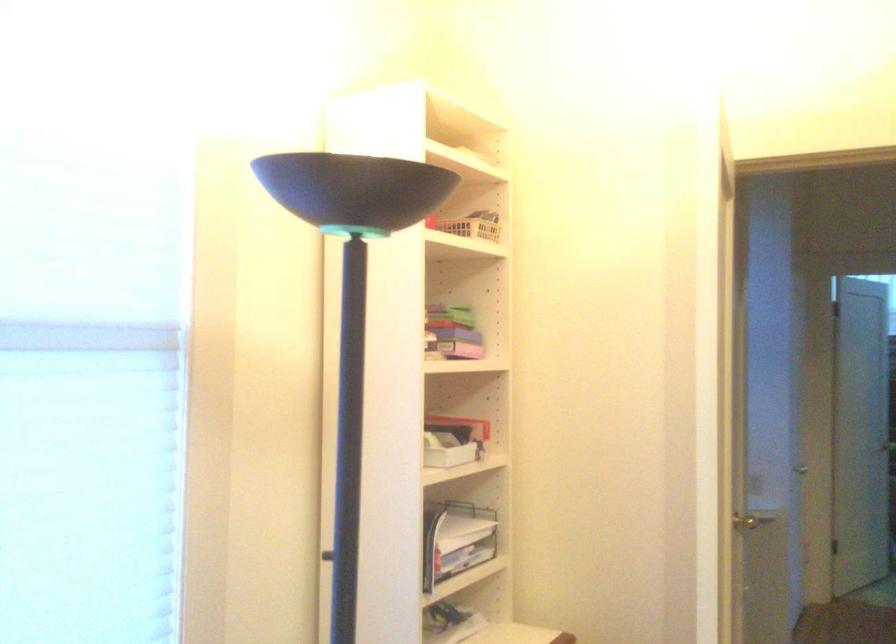
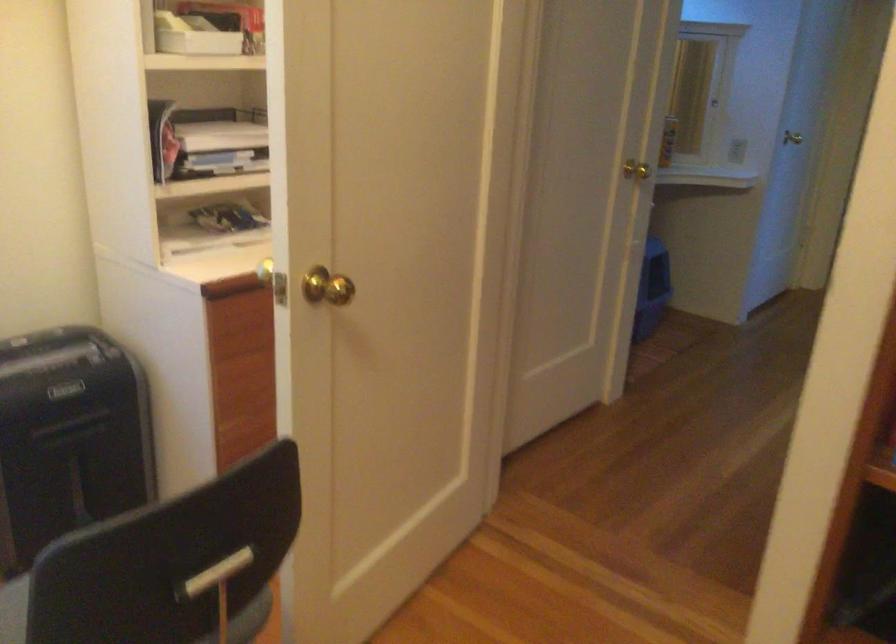
Question: Which direction would the cameraman need to move to produce the second image? Reply with the corresponding letter.

Choices:
 (A) Left
 (B) Right
 (C) Forward
 (D) Backward

Answer: (B)